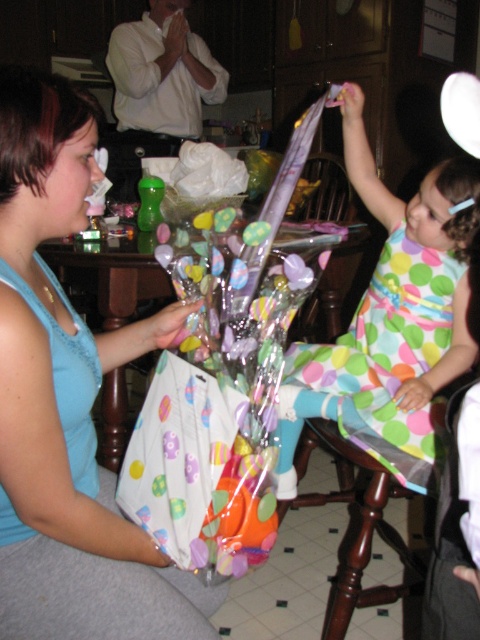
Question: Which point is closer to the camera?

Choices:
 (A) brown wood stool at lower center
 (B) matte blue tank top at left
 (C) polka dot dress at center

Answer: (B)

Question: Estimate the real-world distances between objects in this image. Which object is farther from the matte blue tank top at left?

Choices:
 (A) brown wood stool at lower center
 (B) polka dot dress at center

Answer: (A)

Question: Does polka dot dress at center appear over brown wood stool at lower center?

Choices:
 (A) no
 (B) yes

Answer: (B)

Question: Where is polka dot dress at center located in relation to brown wood stool at lower center in the image?

Choices:
 (A) above
 (B) below

Answer: (A)

Question: Does matte blue tank top at left have a lesser width compared to brown wood stool at lower center?

Choices:
 (A) no
 (B) yes

Answer: (B)

Question: Which point is closer to the camera?

Choices:
 (A) brown wood stool at lower center
 (B) polka dot dress at center
 (C) matte blue tank top at left

Answer: (C)